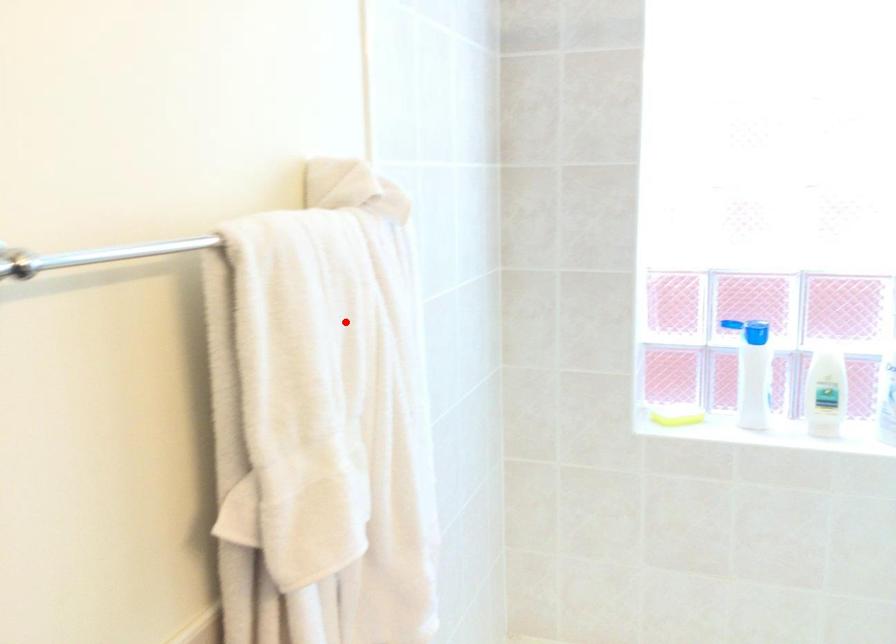
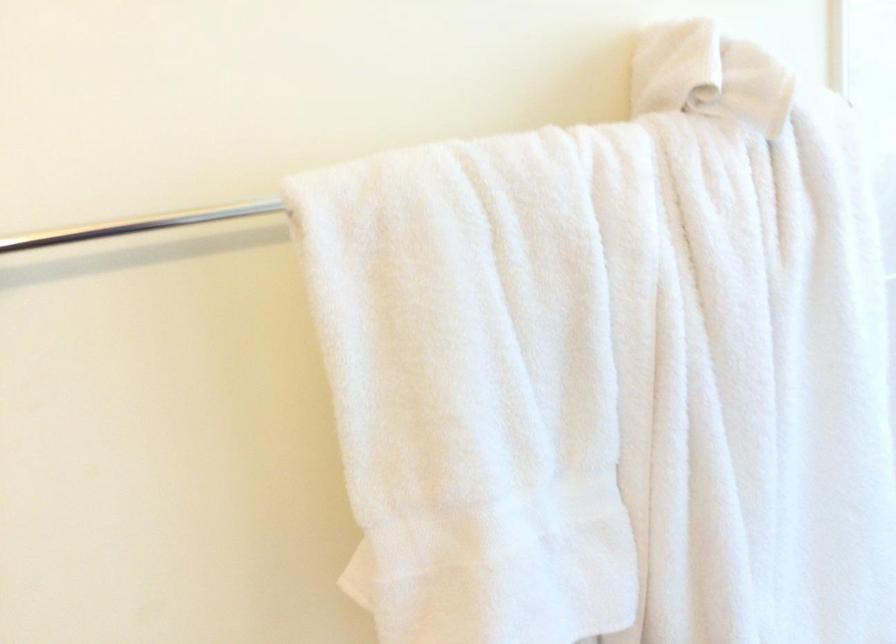
Question: I am providing you with two images of the same scene from different viewpoints. In image1, a red point is highlighted. Considering the same 3D point in image2, which of the following is correct?

Choices:
 (A) It is closer
 (B) It is farther

Answer: (A)